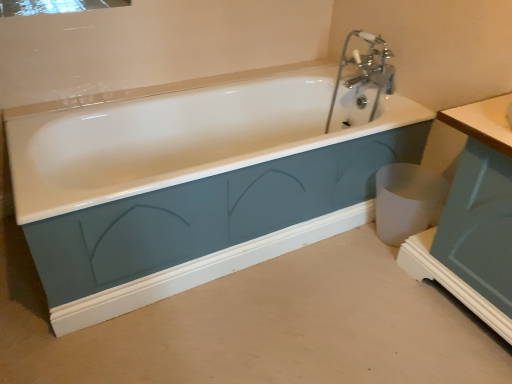
Question: Considering the relative sizes of white matte trash can at lower right and clear glass mirror at upper left in the image provided, is white matte trash can at lower right bigger than clear glass mirror at upper left?

Choices:
 (A) no
 (B) yes

Answer: (B)

Question: Can you confirm if white matte trash can at lower right is taller than clear glass mirror at upper left?

Choices:
 (A) no
 (B) yes

Answer: (B)

Question: Is white matte trash can at lower right outside of clear glass mirror at upper left?

Choices:
 (A) no
 (B) yes

Answer: (B)

Question: Is white matte trash can at lower right shorter than clear glass mirror at upper left?

Choices:
 (A) yes
 (B) no

Answer: (B)

Question: From the image's perspective, is white matte trash can at lower right located beneath clear glass mirror at upper left?

Choices:
 (A) no
 (B) yes

Answer: (B)

Question: Considering the positions of clear glass mirror at upper left and white matte trash can at lower right in the image, is clear glass mirror at upper left taller or shorter than white matte trash can at lower right?

Choices:
 (A) tall
 (B) short

Answer: (B)

Question: From the image's perspective, is clear glass mirror at upper left above or below white matte trash can at lower right?

Choices:
 (A) below
 (B) above

Answer: (B)

Question: From a real-world perspective, relative to white matte trash can at lower right, is clear glass mirror at upper left vertically above or below?

Choices:
 (A) above
 (B) below

Answer: (A)

Question: Looking at the image, does clear glass mirror at upper left seem bigger or smaller compared to white matte trash can at lower right?

Choices:
 (A) big
 (B) small

Answer: (B)

Question: Considering their positions, is white glossy bathtub at center located in front of or behind matte teal cabinet at right?

Choices:
 (A) front
 (B) behind

Answer: (B)

Question: From the image's perspective, is white glossy bathtub at center above or below matte teal cabinet at right?

Choices:
 (A) above
 (B) below

Answer: (A)

Question: Would you say white glossy bathtub at center is to the left or to the right of matte teal cabinet at right in the picture?

Choices:
 (A) right
 (B) left

Answer: (B)

Question: Considering the positions of white glossy bathtub at center and matte teal cabinet at right in the image, is white glossy bathtub at center bigger or smaller than matte teal cabinet at right?

Choices:
 (A) small
 (B) big

Answer: (B)

Question: From the image's perspective, is matte teal cabinet at right located above or below white matte trash can at lower right?

Choices:
 (A) below
 (B) above

Answer: (B)

Question: In the image, is matte teal cabinet at right positioned in front of or behind white matte trash can at lower right?

Choices:
 (A) front
 (B) behind

Answer: (A)